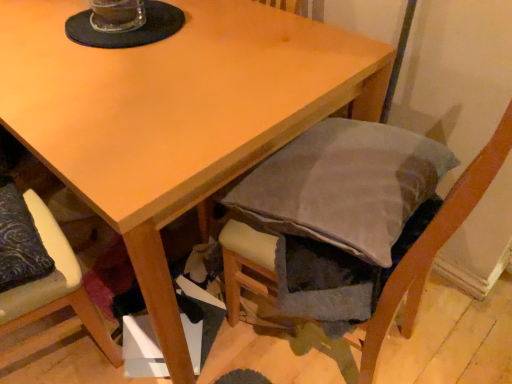
What is the approximate width of velvet gray cushion at lower right, positioned as the 2th chair in left-to-right order?

It is 20.70 inches.

The height and width of the screenshot is (384, 512). Describe the element at coordinates (431, 249) in the screenshot. I see `velvet gray cushion at lower right, positioned as the 2th chair in left-to-right order` at that location.

Locate an element on the screen. This screenshot has height=384, width=512. velvet gray cushion at lower right, the first chair viewed from the right is located at coordinates (431, 249).

This screenshot has width=512, height=384. Describe the element at coordinates (52, 297) in the screenshot. I see `velvet-like beige cushion at lower left, acting as the 1th chair starting from the left` at that location.

Where is `velvet-like beige cushion at lower left, which ranks as the second chair in right-to-left order`? This screenshot has width=512, height=384. velvet-like beige cushion at lower left, which ranks as the second chair in right-to-left order is located at coordinates (52, 297).

Identify the location of velvet gray cushion at lower right, the first chair viewed from the right. The width and height of the screenshot is (512, 384). (431, 249).

Considering the relative positions of velvet gray cushion at lower right, the first chair viewed from the right, and velvet-like beige cushion at lower left, which ranks as the second chair in right-to-left order, in the image provided, is velvet gray cushion at lower right, the first chair viewed from the right, to the right of velvet-like beige cushion at lower left, which ranks as the second chair in right-to-left order, from the viewer's perspective?

Yes, velvet gray cushion at lower right, the first chair viewed from the right, is to the right of velvet-like beige cushion at lower left, which ranks as the second chair in right-to-left order.

Is velvet gray cushion at lower right, the first chair viewed from the right, positioned before velvet-like beige cushion at lower left, acting as the 1th chair starting from the left?

Yes, velvet gray cushion at lower right, the first chair viewed from the right, is closer to the viewer.

Does point (467, 198) come closer to viewer compared to point (96, 337)?

Yes, point (467, 198) is in front of point (96, 337).

From the image's perspective, which is below, velvet gray cushion at lower right, the first chair viewed from the right, or velvet-like beige cushion at lower left, acting as the 1th chair starting from the left?

From the image's view, velvet-like beige cushion at lower left, acting as the 1th chair starting from the left, is below.

From a real-world perspective, is velvet gray cushion at lower right, positioned as the 2th chair in left-to-right order, on velvet-like beige cushion at lower left, acting as the 1th chair starting from the left?

Yes, from a real-world perspective, velvet gray cushion at lower right, positioned as the 2th chair in left-to-right order, is over velvet-like beige cushion at lower left, acting as the 1th chair starting from the left

Can you confirm if velvet gray cushion at lower right, positioned as the 2th chair in left-to-right order, is wider than velvet-like beige cushion at lower left, acting as the 1th chair starting from the left?

Correct, the width of velvet gray cushion at lower right, positioned as the 2th chair in left-to-right order, exceeds that of velvet-like beige cushion at lower left, acting as the 1th chair starting from the left.

Can you confirm if velvet gray cushion at lower right, positioned as the 2th chair in left-to-right order, is shorter than velvet-like beige cushion at lower left, acting as the 1th chair starting from the left?

No.

Looking at this image, can you confirm if velvet gray cushion at lower right, the first chair viewed from the right, is smaller than velvet-like beige cushion at lower left, acting as the 1th chair starting from the left?

Actually, velvet gray cushion at lower right, the first chair viewed from the right, might be larger than velvet-like beige cushion at lower left, acting as the 1th chair starting from the left.

Is velvet-like beige cushion at lower left, acting as the 1th chair starting from the left, a part of velvet gray cushion at lower right, the first chair viewed from the right?

No, velvet-like beige cushion at lower left, acting as the 1th chair starting from the left, is located outside of velvet gray cushion at lower right, the first chair viewed from the right.

Is velvet gray cushion at lower right, positioned as the 2th chair in left-to-right order, not near velvet-like beige cushion at lower left, which ranks as the second chair in right-to-left order?

No, velvet gray cushion at lower right, positioned as the 2th chair in left-to-right order, is not far away from velvet-like beige cushion at lower left, which ranks as the second chair in right-to-left order.

Is velvet gray cushion at lower right, the first chair viewed from the right, facing away from velvet-like beige cushion at lower left, which ranks as the second chair in right-to-left order?

velvet gray cushion at lower right, the first chair viewed from the right, does not have its back to velvet-like beige cushion at lower left, which ranks as the second chair in right-to-left order.

Where is `chair that appears above the velvet-like beige cushion at lower left, acting as the 1th chair starting from the left (from a real-world perspective)`? chair that appears above the velvet-like beige cushion at lower left, acting as the 1th chair starting from the left (from a real-world perspective) is located at coordinates (431, 249).

Is velvet-like beige cushion at lower left, which ranks as the second chair in right-to-left order, to the left of velvet gray cushion at lower right, positioned as the 2th chair in left-to-right order, from the viewer's perspective?

Indeed, velvet-like beige cushion at lower left, which ranks as the second chair in right-to-left order, is positioned on the left side of velvet gray cushion at lower right, positioned as the 2th chair in left-to-right order.

Relative to velvet gray cushion at lower right, the first chair viewed from the right, is velvet-like beige cushion at lower left, acting as the 1th chair starting from the left, in front or behind?

Clearly, velvet-like beige cushion at lower left, acting as the 1th chair starting from the left, is behind velvet gray cushion at lower right, the first chair viewed from the right.

Is point (12, 347) closer or farther from the camera than point (412, 309)?

Point (12, 347) is positioned closer to the camera compared to point (412, 309).

From the image's perspective, which one is positioned lower, velvet-like beige cushion at lower left, acting as the 1th chair starting from the left, or velvet gray cushion at lower right, the first chair viewed from the right?

velvet-like beige cushion at lower left, acting as the 1th chair starting from the left.

From a real-world perspective, is velvet-like beige cushion at lower left, which ranks as the second chair in right-to-left order, located beneath velvet gray cushion at lower right, positioned as the 2th chair in left-to-right order?

Yes, from a real-world perspective, velvet-like beige cushion at lower left, which ranks as the second chair in right-to-left order, is beneath velvet gray cushion at lower right, positioned as the 2th chair in left-to-right order.

Considering the relative sizes of velvet-like beige cushion at lower left, which ranks as the second chair in right-to-left order, and velvet gray cushion at lower right, positioned as the 2th chair in left-to-right order, in the image provided, is velvet-like beige cushion at lower left, which ranks as the second chair in right-to-left order, wider than velvet gray cushion at lower right, positioned as the 2th chair in left-to-right order,?

In fact, velvet-like beige cushion at lower left, which ranks as the second chair in right-to-left order, might be narrower than velvet gray cushion at lower right, positioned as the 2th chair in left-to-right order.

Which of these two, velvet-like beige cushion at lower left, acting as the 1th chair starting from the left, or velvet gray cushion at lower right, the first chair viewed from the right, stands shorter?

velvet-like beige cushion at lower left, acting as the 1th chair starting from the left.

Between velvet-like beige cushion at lower left, acting as the 1th chair starting from the left, and velvet gray cushion at lower right, positioned as the 2th chair in left-to-right order, which one has smaller size?

Smaller between the two is velvet-like beige cushion at lower left, acting as the 1th chair starting from the left.

Is velvet-like beige cushion at lower left, acting as the 1th chair starting from the left, outside of velvet gray cushion at lower right, the first chair viewed from the right?

Yes, velvet-like beige cushion at lower left, acting as the 1th chair starting from the left, is not within velvet gray cushion at lower right, the first chair viewed from the right.

Are velvet-like beige cushion at lower left, which ranks as the second chair in right-to-left order, and velvet gray cushion at lower right, the first chair viewed from the right, beside each other?

velvet-like beige cushion at lower left, which ranks as the second chair in right-to-left order, is not next to velvet gray cushion at lower right, the first chair viewed from the right, and they're not touching.

Is velvet-like beige cushion at lower left, which ranks as the second chair in right-to-left order, oriented towards velvet gray cushion at lower right, the first chair viewed from the right?

No, velvet-like beige cushion at lower left, which ranks as the second chair in right-to-left order, is not oriented towards velvet gray cushion at lower right, the first chair viewed from the right.

In the scene shown: Could you measure the distance between velvet-like beige cushion at lower left, acting as the 1th chair starting from the left, and velvet gray cushion at lower right, the first chair viewed from the right?

The distance of velvet-like beige cushion at lower left, acting as the 1th chair starting from the left, from velvet gray cushion at lower right, the first chair viewed from the right, is 19.34 inches.

In order to click on chair located above the velvet-like beige cushion at lower left, which ranks as the second chair in right-to-left order (from the image's perspective) in this screenshot , I will do point(431,249).

Locate an element on the screen. The height and width of the screenshot is (384, 512). chair in front of the velvet-like beige cushion at lower left, which ranks as the second chair in right-to-left order is located at coordinates (431, 249).

The image size is (512, 384). What are the coordinates of `chair below the velvet gray cushion at lower right, positioned as the 2th chair in left-to-right order (from the image's perspective)` in the screenshot? It's located at (52, 297).